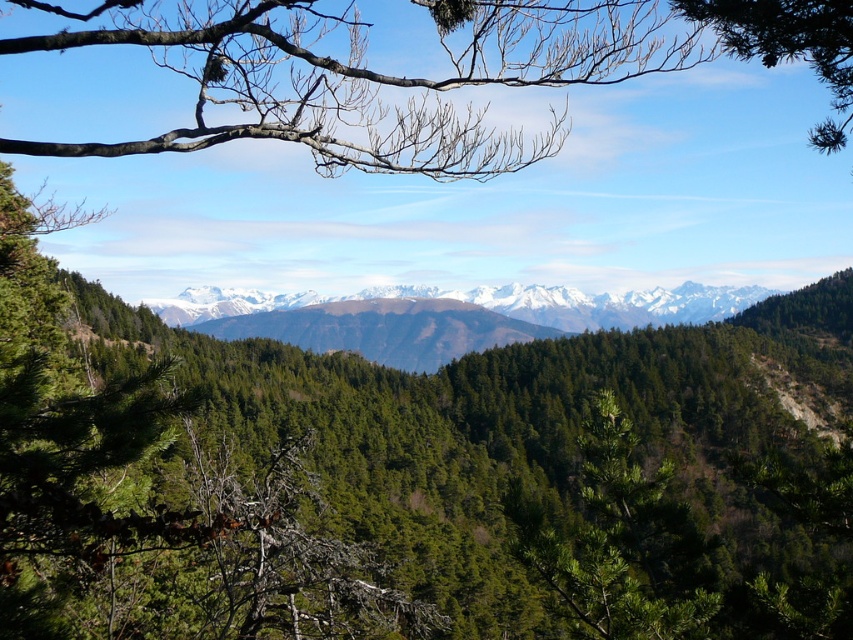
You are standing at the point where the coordinates are (432, 77) in the image. Looking at the scene, what do you see above you?

You see bare branches at upper center above you at point (432, 77).

You are an outdoor photographer planning to capture a wide landscape shot of the green matte tree at center and the snowy rocky mountain range at center. Based on the scene description, which object appears narrower in the image?

The green matte tree at center appears narrower than the snowy rocky mountain range at center in the image.